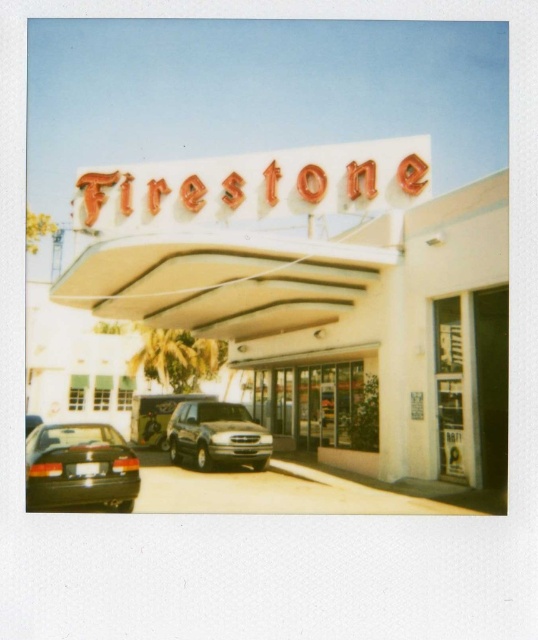
Does point (491, 218) come closer to viewer compared to point (194, 182)?

That is True.

Which is in front, point (407, 253) or point (334, 196)?

Point (407, 253) is more forward.

Where is `white matte sign at upper center`? This screenshot has width=538, height=640. white matte sign at upper center is located at coordinates (322, 298).

Which is more to the left, shiny black sedan at lower left or dark gray metallic suv at center?

From the viewer's perspective, shiny black sedan at lower left appears more on the left side.

Locate an element on the screen. This screenshot has width=538, height=640. shiny black sedan at lower left is located at coordinates tap(80, 467).

This screenshot has height=640, width=538. In order to click on shiny black sedan at lower left in this screenshot , I will do `click(80, 467)`.

Does white matte sign at upper center have a greater height compared to dark gray metallic suv at center?

Yes.

Which is more to the left, white matte sign at upper center or dark gray metallic suv at center?

From the viewer's perspective, dark gray metallic suv at center appears more on the left side.

Is point (295, 332) less distant than point (182, 436)?

No, it is behind (182, 436).

Image resolution: width=538 pixels, height=640 pixels. Find the location of `white matte sign at upper center`. white matte sign at upper center is located at coordinates (322, 298).